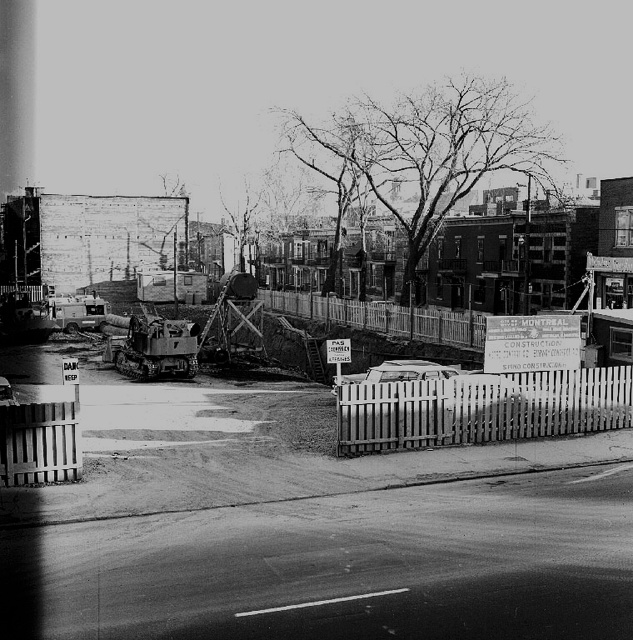
Question: Which point is farther to the camera?

Choices:
 (A) white picket fence at center
 (B) wooden picket fence at lower right

Answer: (A)

Question: Considering the relative positions of wooden picket fence at lower right and white picket fence at center in the image provided, where is wooden picket fence at lower right located with respect to white picket fence at center?

Choices:
 (A) right
 (B) left

Answer: (A)

Question: Among these objects, which one is farthest from the camera?

Choices:
 (A) white picket fence at center
 (B) wooden picket fence at lower right

Answer: (A)

Question: Which object is closer to the camera taking this photo?

Choices:
 (A) white picket fence at center
 (B) wooden picket fence at lower right

Answer: (B)

Question: Is wooden picket fence at lower right above white picket fence at center?

Choices:
 (A) no
 (B) yes

Answer: (A)

Question: Can you confirm if wooden picket fence at lower right is bigger than white picket fence at center?

Choices:
 (A) no
 (B) yes

Answer: (A)